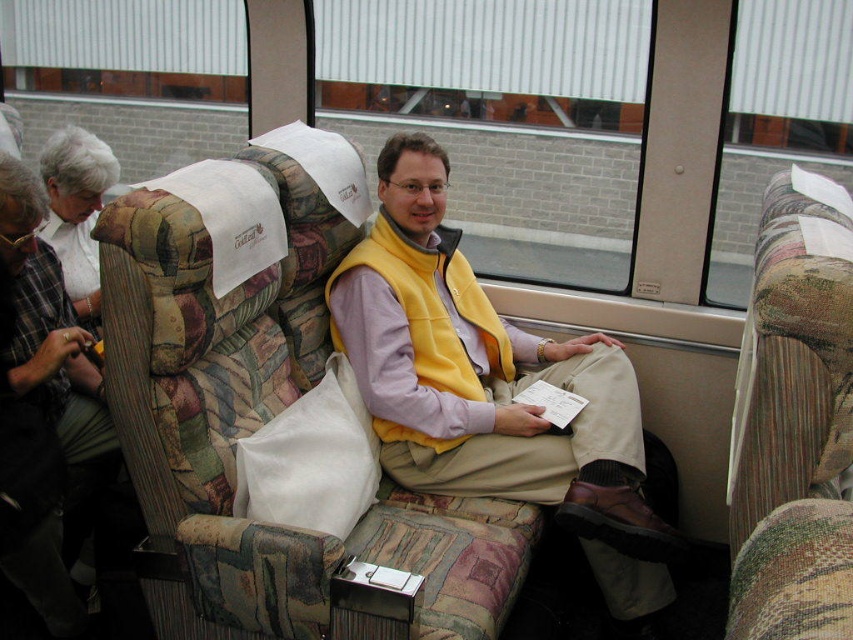
Who is more forward, (268, 572) or (62, 250)?

Point (268, 572)

Is patterned fabric armchair at center closer to camera compared to white fabric at upper left?

Yes, patterned fabric armchair at center is in front of white fabric at upper left.

This screenshot has width=853, height=640. Describe the element at coordinates (265, 406) in the screenshot. I see `patterned fabric armchair at center` at that location.

At what (x,y) coordinates should I click in order to perform the action: click on patterned fabric armchair at center. Please return your answer as a coordinate pair (x, y). The width and height of the screenshot is (853, 640). Looking at the image, I should click on (265, 406).

This screenshot has width=853, height=640. What do you see at coordinates (793, 420) in the screenshot?
I see `camouflage fabric armchair at center` at bounding box center [793, 420].

Is camouflage fabric armchair at center positioned at the back of plaid fabric coach at left?

That is False.

Between point (833, 452) and point (38, 531), which one is positioned in front?

Point (833, 452)

Where is `camouflage fabric armchair at center`? The image size is (853, 640). camouflage fabric armchair at center is located at coordinates (793, 420).

Is point (440, 346) more distant than point (12, 364)?

Yes, it is behind point (12, 364).

Is yellow fleece vest at center positioned in front of plaid fabric coach at left?

No, yellow fleece vest at center is behind plaid fabric coach at left.

The width and height of the screenshot is (853, 640). What do you see at coordinates (492, 388) in the screenshot? I see `yellow fleece vest at center` at bounding box center [492, 388].

Locate an element on the screen. This screenshot has height=640, width=853. yellow fleece vest at center is located at coordinates (492, 388).